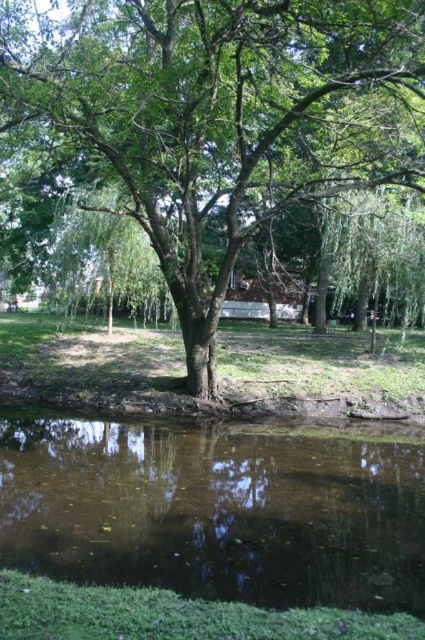
Question: Does green leafy tree at center have a greater width compared to brown murky water at bottom?

Choices:
 (A) yes
 (B) no

Answer: (A)

Question: Considering the relative positions of green leafy tree at center and brown murky water at bottom in the image provided, where is green leafy tree at center located with respect to brown murky water at bottom?

Choices:
 (A) above
 (B) below

Answer: (A)

Question: Which object is closer to the camera taking this photo?

Choices:
 (A) brown murky water at bottom
 (B) green leafy tree at center

Answer: (A)

Question: Can you confirm if green leafy tree at center is positioned to the right of brown murky water at bottom?

Choices:
 (A) no
 (B) yes

Answer: (B)